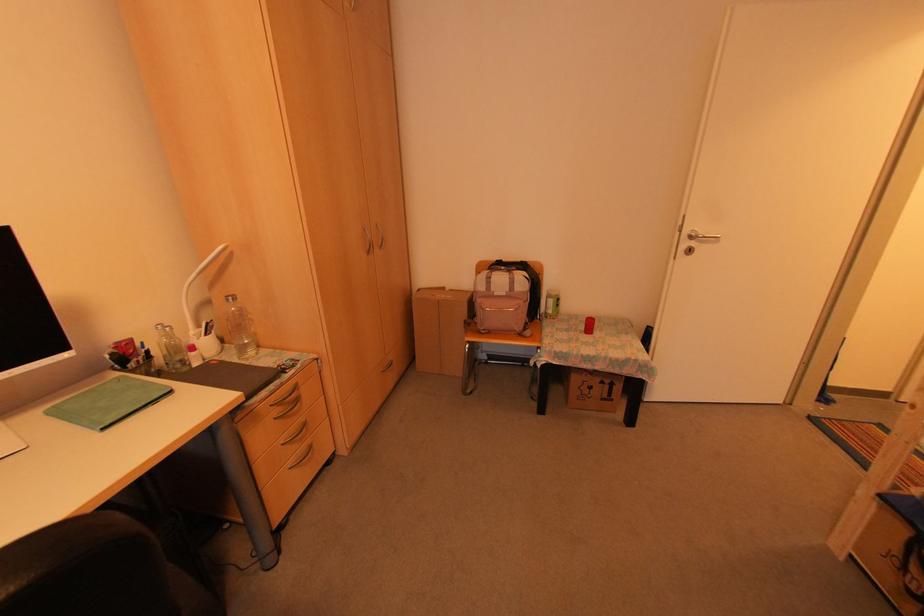
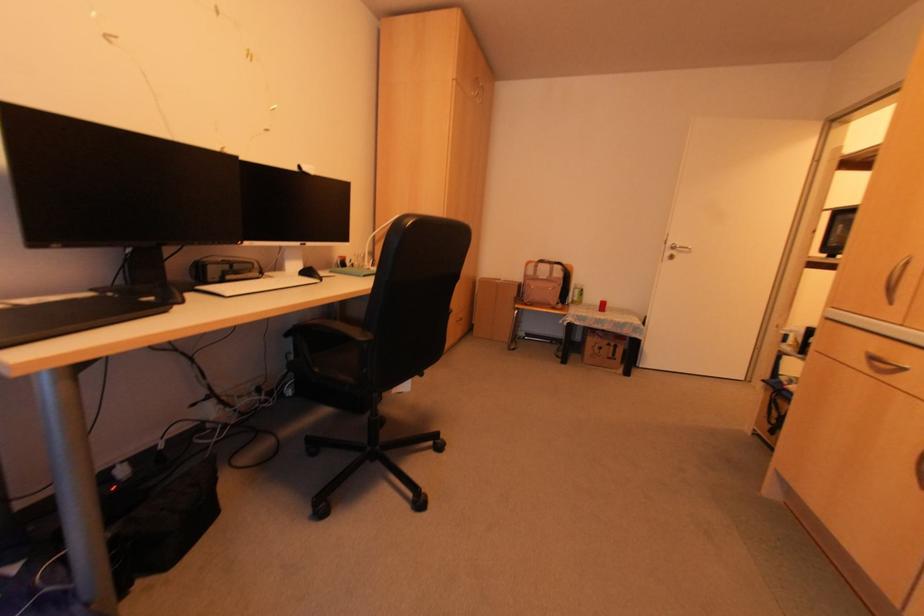
Find the pixel in the second image that matches (690,231) in the first image.

(671, 245)